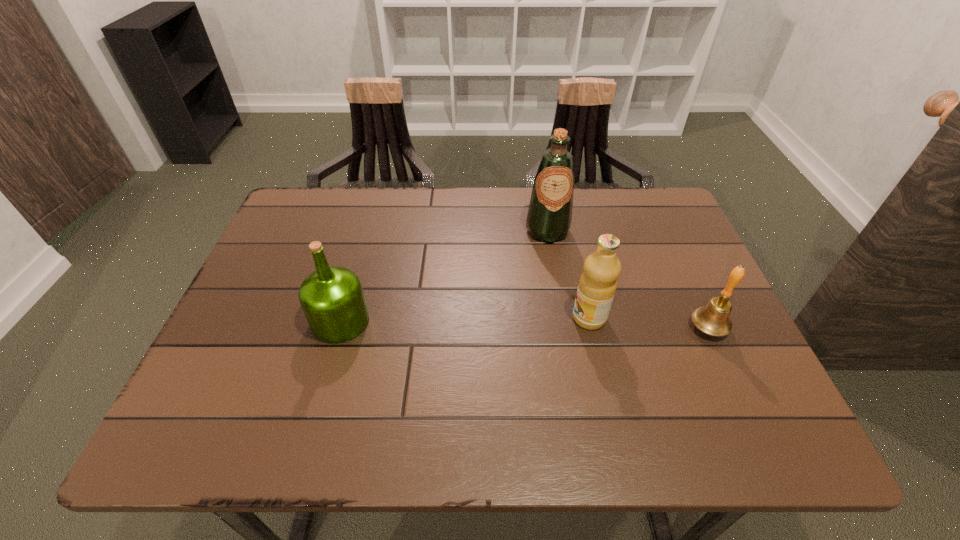
Where is `blank space at the far edge`? blank space at the far edge is located at coordinates (506, 207).

This screenshot has width=960, height=540. What are the coordinates of `vacant space at the near edge of the desktop` in the screenshot? It's located at (263, 440).

I want to click on free space at the right edge of the desktop, so click(x=676, y=280).

Locate an element on the screen. This screenshot has width=960, height=540. free area in between the rightmost object and the leftmost object is located at coordinates (524, 325).

Where is `unoccupied position between the bell and the farthest olive oil`? unoccupied position between the bell and the farthest olive oil is located at coordinates (628, 279).

Locate an element on the screen. free space between the rightmost object and the farthest object is located at coordinates (628, 279).

In order to click on vacant region between the leftmost object and the tallest object in this screenshot , I will do `click(444, 276)`.

This screenshot has height=540, width=960. Identify the location of free space between the bell and the leftmost object. (524, 325).

This screenshot has width=960, height=540. What are the coordinates of `the third closest object to the leftmost olive oil` in the screenshot? It's located at (713, 319).

This screenshot has height=540, width=960. Find the location of `the closest object to the tallest olive oil`. the closest object to the tallest olive oil is located at coordinates (597, 285).